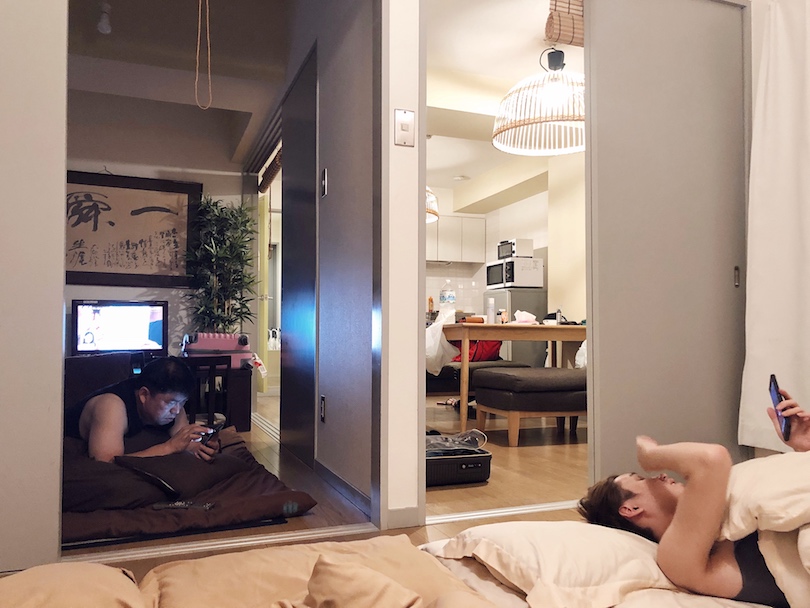
Identify the location of places to sit. This screenshot has height=608, width=810. [535, 384], [474, 364].